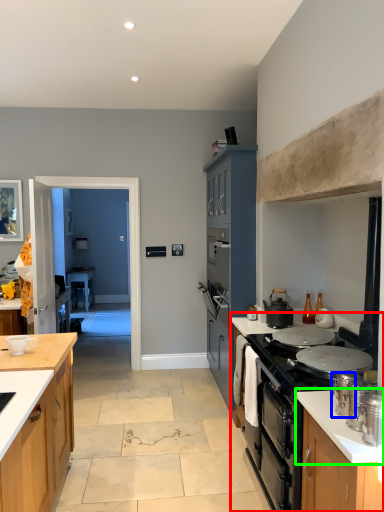
Question: Estimate the real-world distances between objects in this image. Which object is farther from countertop (highlighted by a red box), kitchen appliance (highlighted by a blue box) or countertop (highlighted by a green box)?

Choices:
 (A) kitchen appliance
 (B) countertop

Answer: (A)